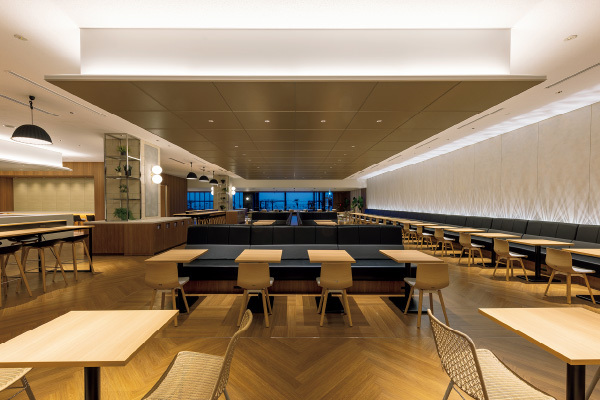
Identify the location of shelves in image. (135, 157), (131, 176), (135, 198), (110, 217).